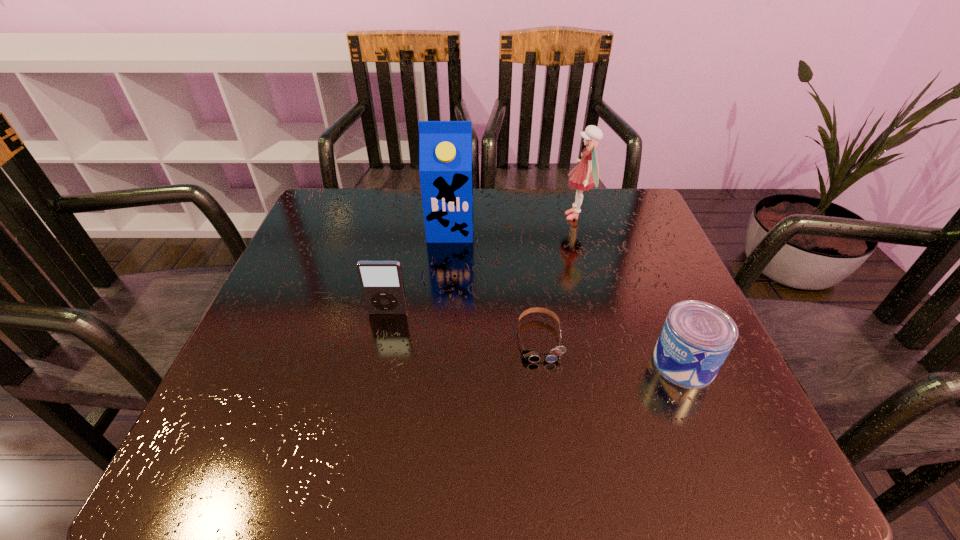
Locate an element on the screen. The width and height of the screenshot is (960, 540). free space in the image that satisfies the following two spatial constraints: 1. on the front-facing side of the doll; 2. on the front-facing side of the goggles is located at coordinates (612, 339).

Identify the location of free space that satisfies the following two spatial constraints: 1. on the front-facing side of the fourth object from left to right; 2. on the front-facing side of the third tallest object. The height and width of the screenshot is (540, 960). coord(604,313).